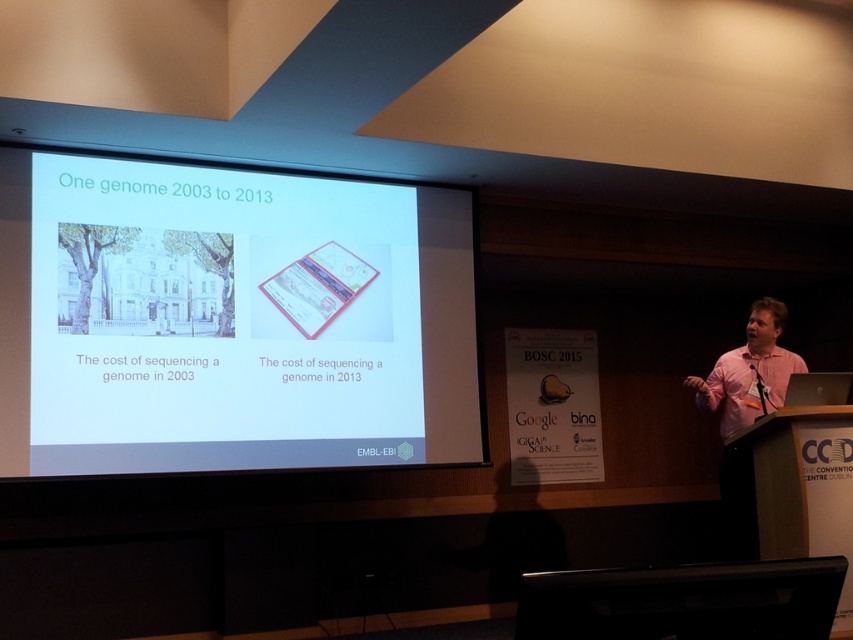
Question: Can you confirm if white paper at center is positioned to the left of pink shirt at right?

Choices:
 (A) yes
 (B) no

Answer: (A)

Question: Can you confirm if white paper at center is smaller than pink shirt at right?

Choices:
 (A) yes
 (B) no

Answer: (B)

Question: Which of the following is the closest to the observer?

Choices:
 (A) white paper at center
 (B) pink shirt at right

Answer: (A)

Question: Does white paper at center have a greater width compared to pink shirt at right?

Choices:
 (A) yes
 (B) no

Answer: (A)

Question: Which point appears closest to the camera in this image?

Choices:
 (A) (762, 300)
 (B) (317, 324)

Answer: (B)

Question: Which point appears closest to the camera in this image?

Choices:
 (A) (224, 230)
 (B) (757, 326)

Answer: (A)